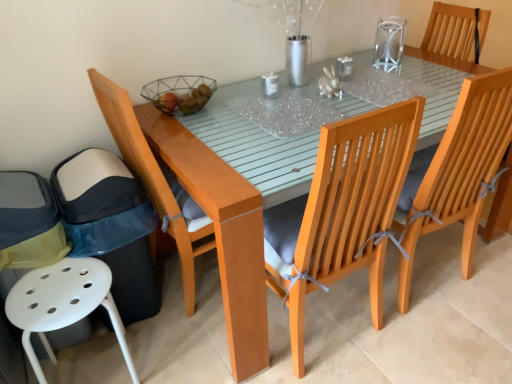
At what (x,y) coordinates should I click in order to perform the action: click on free space to the left of clear glass vase at upper right. Please return your answer as a coordinate pair (x, y). This screenshot has height=384, width=512. Looking at the image, I should click on (365, 60).